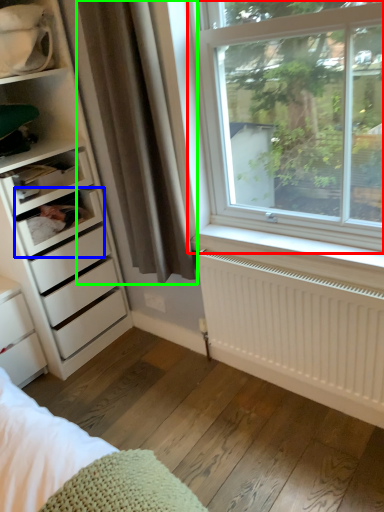
Question: Based on their relative distances, which object is nearer to window (highlighted by a red box)? Choose from shelf (highlighted by a blue box) and curtain (highlighted by a green box).

Choices:
 (A) shelf
 (B) curtain

Answer: (B)